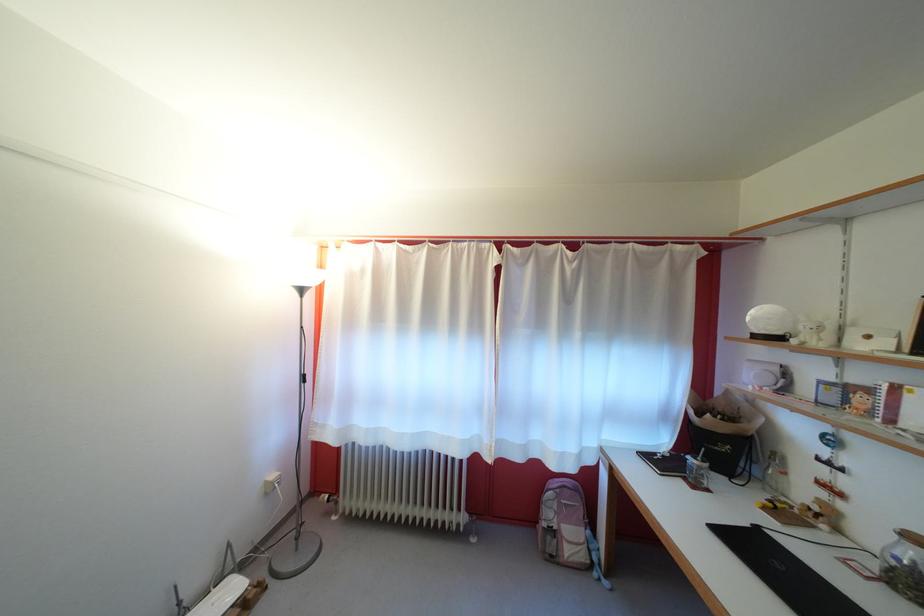
This screenshot has width=924, height=616. I want to click on white spherical lamp, so click(304, 278).